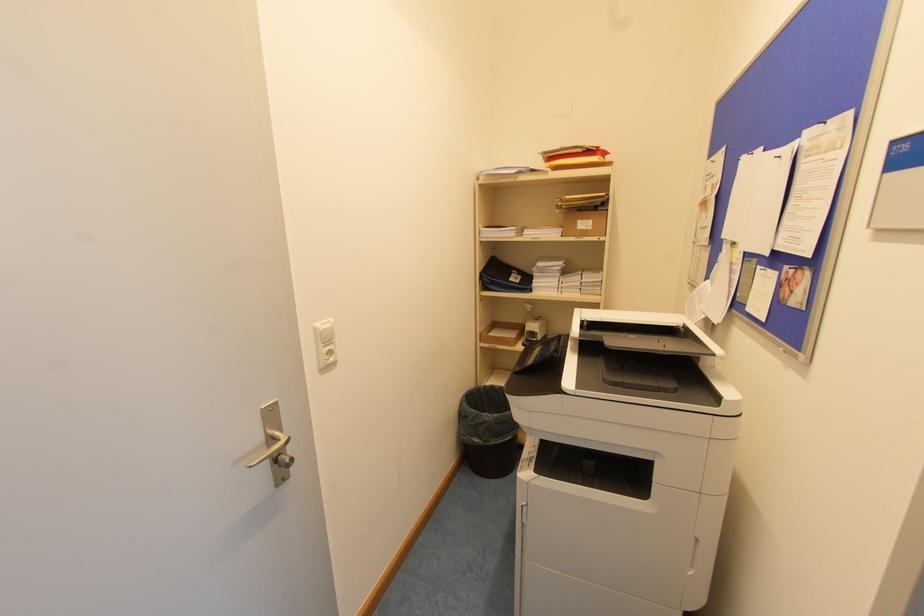
The image size is (924, 616). I want to click on printer document feeder, so click(x=641, y=361).